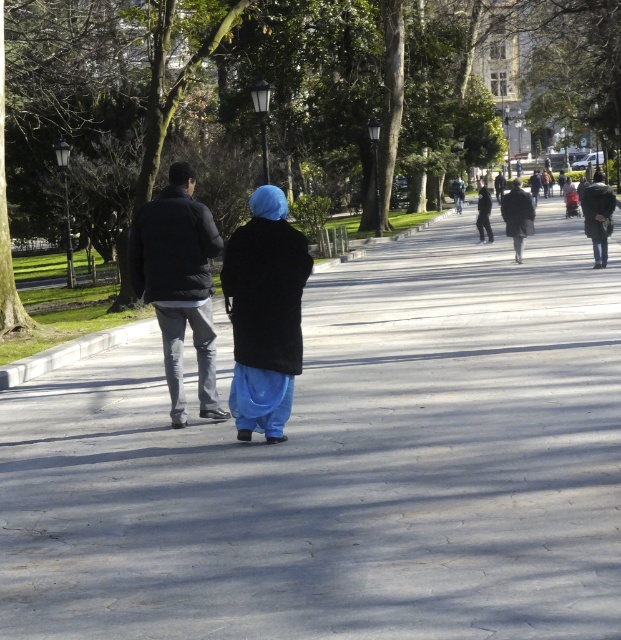
You are standing at the park entrance and see two people walking away from you. The dark gray jacket at center is below the dark gray coat at right. Which person is closer to you?

The dark gray jacket at center is closer to you because it is positioned below the dark gray coat at right, indicating it is in front and nearer to your viewpoint.

You are standing at the park entrance and see the dark gray jacket at center and the black matte coat at center. Which person is closer to the camera?

The dark gray jacket at center is below the black matte coat at center, so the dark gray jacket at center is closer to the camera.

You are standing at the camera position looking at the scene. What are the coordinates of the dark gray jacket at center?

The coordinates of the dark gray jacket at center are at point (178, 284).